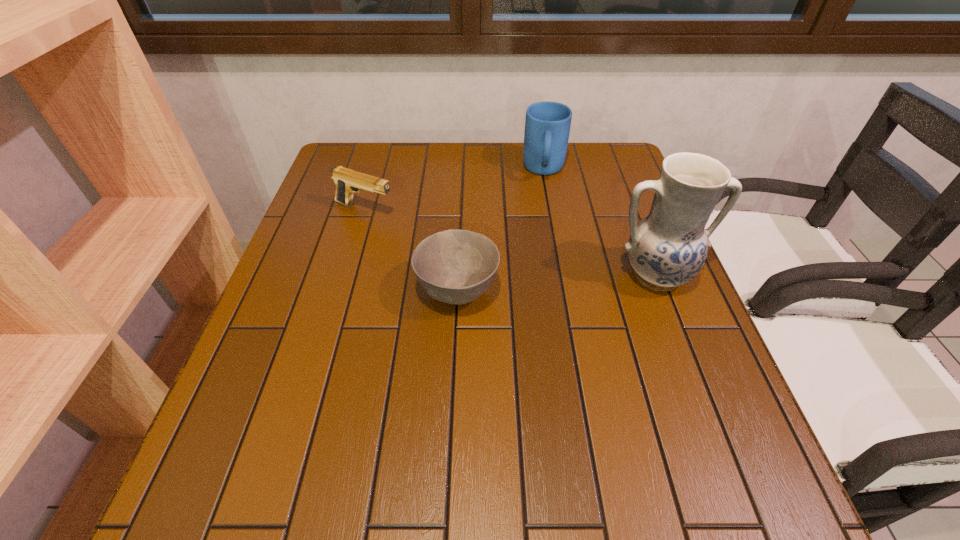
Locate an element on the screen. Image resolution: width=960 pixels, height=540 pixels. bowl is located at coordinates (455, 266).

Identify the location of the rightmost object. The width and height of the screenshot is (960, 540). (668, 247).

Locate an element on the screen. the tallest object is located at coordinates (668, 247).

Find the location of a particular element. This screenshot has width=960, height=540. the second tallest object is located at coordinates point(547,125).

Identify the location of mug. (547, 125).

You are a GUI agent. You are given a task and a screenshot of the screen. Output one action in this format:
    pyautogui.click(x=<x>, y=<y>)
    Task: Click on the second farthest object
    This screenshot has height=540, width=960.
    Given the screenshot: What is the action you would take?
    point(347,181)

Identify the location of the leftmost object. (347, 181).

At what (x,y) coordinates should I click in order to perform the action: click on free space located on the left of the bowl. Please return your answer as a coordinate pair (x, y). Looking at the image, I should click on (317, 291).

Locate an element on the screen. The height and width of the screenshot is (540, 960). free space located 0.090m on the front of the pottery is located at coordinates (679, 335).

You are a GUI agent. You are given a task and a screenshot of the screen. Output one action in this format:
    pyautogui.click(x=<x>, y=<y>)
    Task: Click on the free space located 0.160m on the side of the second object from right to left with the handle
    This screenshot has width=960, height=540.
    Given the screenshot: What is the action you would take?
    pyautogui.click(x=544, y=224)